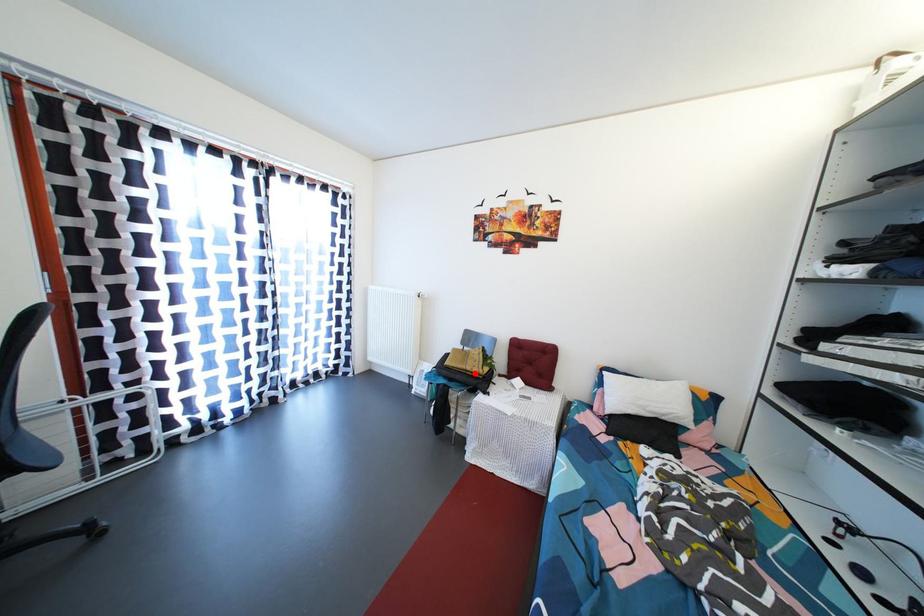
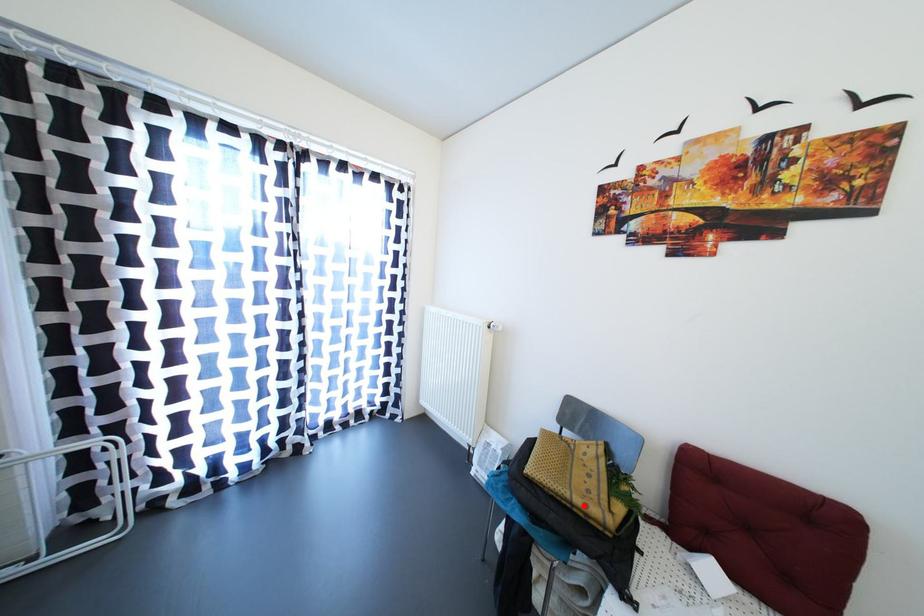
I am providing you with two images of the same scene from different viewpoints. A red point is marked on the first image and another point is marked on the second image. Do the highlighted points in image1 and image2 indicate the same real-world spot?

Yes